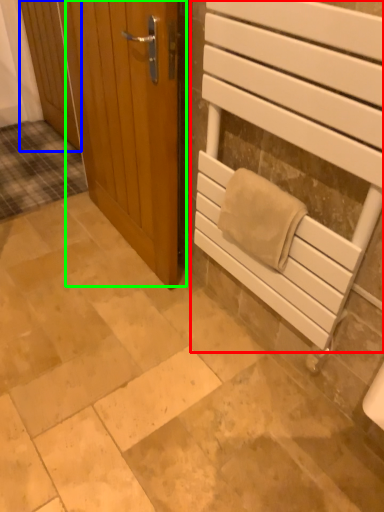
Question: Based on their relative distances, which object is nearer to elevator (highlighted by a red box)? Choose from door (highlighted by a blue box) and door (highlighted by a green box).

Choices:
 (A) door
 (B) door

Answer: (B)